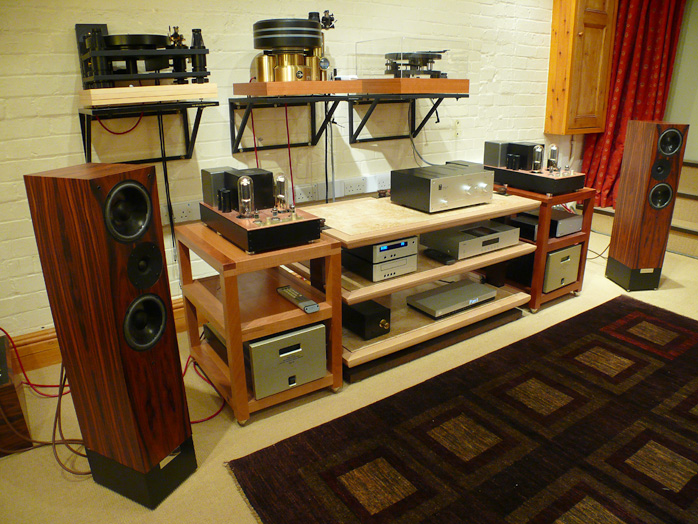
The width and height of the screenshot is (698, 524). I want to click on left rolling shelves, so click(x=232, y=330).